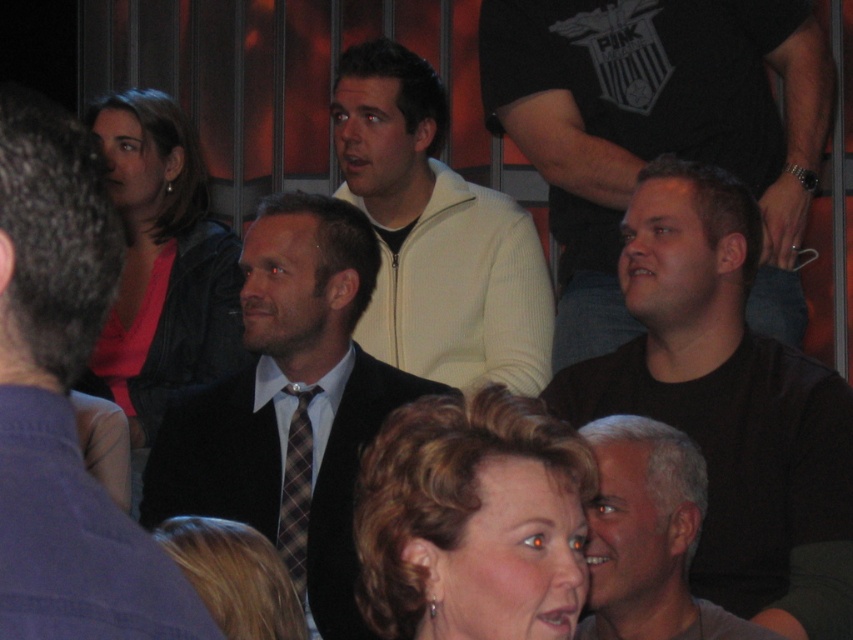
Does dark suit at center come behind matte black jacket at center?

That is False.

Is point (296, 236) farther from camera compared to point (131, 282)?

No, it is in front of (131, 282).

Find the location of `dark suit at center`. dark suit at center is located at coordinates (289, 404).

Based on the photo, which is more to the right, dark suit at center or gray matte shirt at lower right?

gray matte shirt at lower right

At what (x,y) coordinates should I click in order to perform the action: click on dark suit at center. Please return your answer as a coordinate pair (x, y). This screenshot has height=640, width=853. Looking at the image, I should click on (289, 404).

Who is shorter, gray matte shirt at lower right or plaid fabric tie at center?

With less height is gray matte shirt at lower right.

Between point (634, 593) and point (280, 506), which one is positioned in front?

Point (634, 593) is in front.

Is point (688, 540) more distant than point (286, 556)?

No.

I want to click on gray matte shirt at lower right, so click(648, 538).